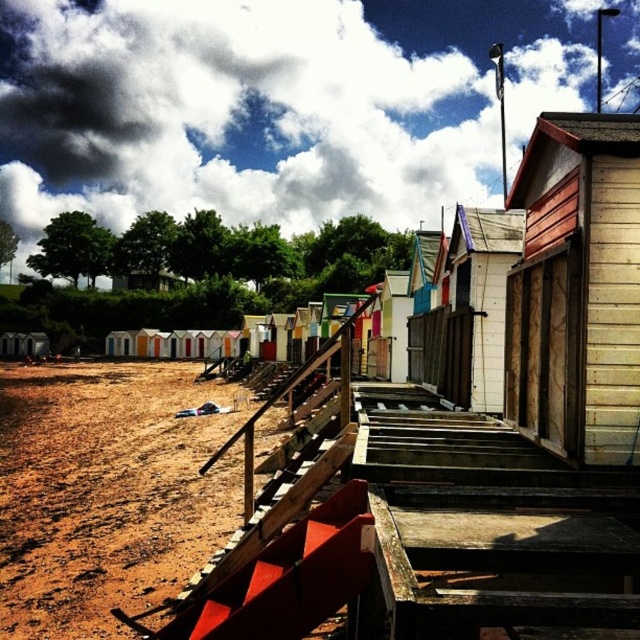
Who is more distant from viewer, (124, 387) or (522, 404)?

The point (124, 387) is behind.

The height and width of the screenshot is (640, 640). I want to click on brown sandy dirt at lower left, so click(x=106, y=492).